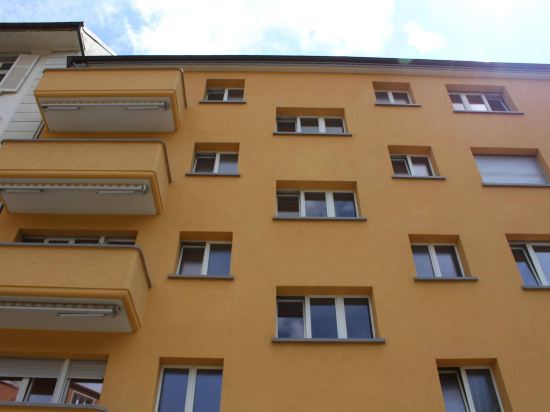
Locate an element on the screen. windows with reflection of another building is located at coordinates (79, 395), (8, 395).